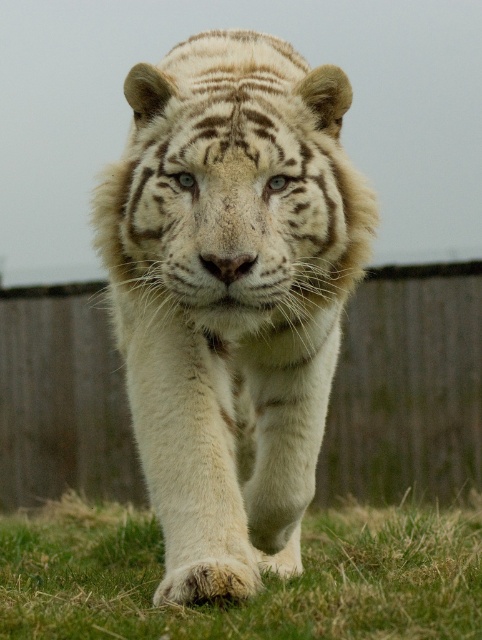
You are a photographer trying to capture the white tiger in the image. The wooden fence at center is represented by point (406, 387). If you want to adjust your camera to focus on the wooden fence at center, which coordinate should you aim for?

The wooden fence at center is represented by point (406, 387), so you should aim for coordinate (406, 387) to focus on it.

From the picture: You are a wildlife photographer trying to capture a close shot of the white fur tiger at center. Since the green grass at lower center might obstruct the view, can you confirm if the tiger is bigger than the grass?

The white fur tiger at center is larger in size than green grass at lower center, so yes, the tiger is bigger and less likely to be obstructed by the grass.

You are a wildlife photographer aiming to capture the white fur tiger at center. You notice the green grass at lower center in the frame. Where should you focus your camera to ensure the tiger is sharp while keeping the grass slightly out of focus?

To ensure the white fur tiger at center is sharp while keeping the green grass at lower center slightly out of focus, focus on the tiger since it is positioned over the grass, maintaining a shallow depth of field.